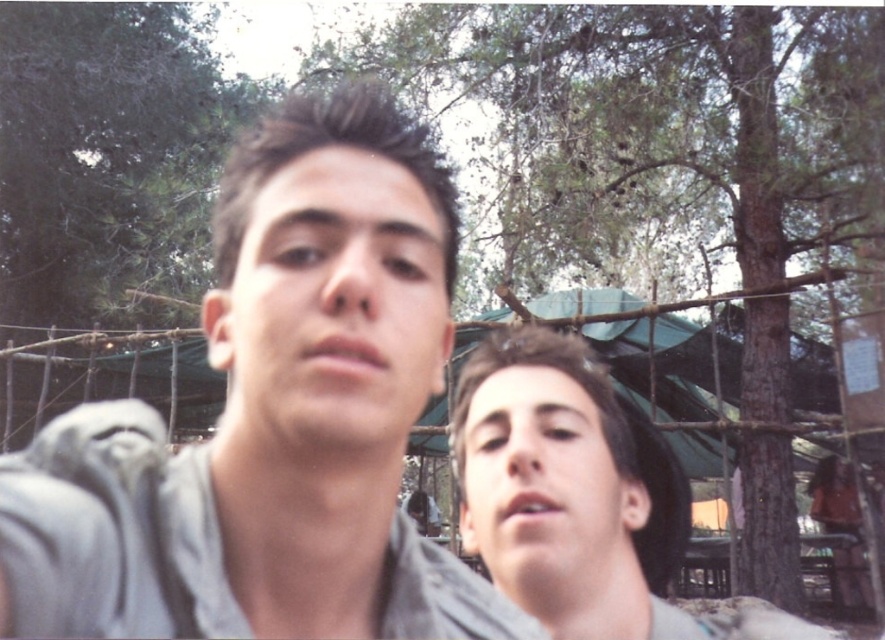
Which of these two, smooth skin face at center or smooth skin face at lower right, stands taller?

Standing taller between the two is smooth skin face at lower right.

Does smooth skin face at center appear over smooth skin face at lower right?

Indeed, smooth skin face at center is positioned over smooth skin face at lower right.

Is point (345, 310) farther from camera compared to point (499, 504)?

No, (345, 310) is closer to viewer.

At what (x,y) coordinates should I click in order to perform the action: click on smooth skin face at center. Please return your answer as a coordinate pair (x, y). The height and width of the screenshot is (640, 885). Looking at the image, I should click on (333, 305).

Measure the distance between gray matte shirt at center and smooth skin face at center.

A distance of 4.80 centimeters exists between gray matte shirt at center and smooth skin face at center.

How distant is gray matte shirt at center from smooth skin face at center?

They are 4.80 centimeters apart.

Does point (506, 611) come farther from viewer compared to point (428, 368)?

Yes, point (506, 611) is farther from viewer.

At what (x,y) coordinates should I click in order to perform the action: click on gray matte shirt at center. Please return your answer as a coordinate pair (x, y). This screenshot has width=885, height=640. Looking at the image, I should click on (271, 419).

Who is positioned more to the right, gray matte shirt at center or green leafy tree at upper center?

From the viewer's perspective, green leafy tree at upper center appears more on the right side.

From the picture: Can you confirm if gray matte shirt at center is taller than green leafy tree at upper center?

Incorrect, gray matte shirt at center's height is not larger of green leafy tree at upper center's.

What do you see at coordinates (271, 419) in the screenshot?
I see `gray matte shirt at center` at bounding box center [271, 419].

Find the location of `gray matte shirt at center`. gray matte shirt at center is located at coordinates pyautogui.click(x=271, y=419).